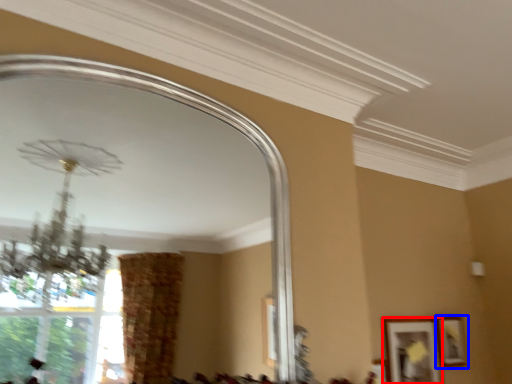
Question: Which object is further to the camera taking this photo, picture frame (highlighted by a red box) or picture frame (highlighted by a blue box)?

Choices:
 (A) picture frame
 (B) picture frame

Answer: (B)